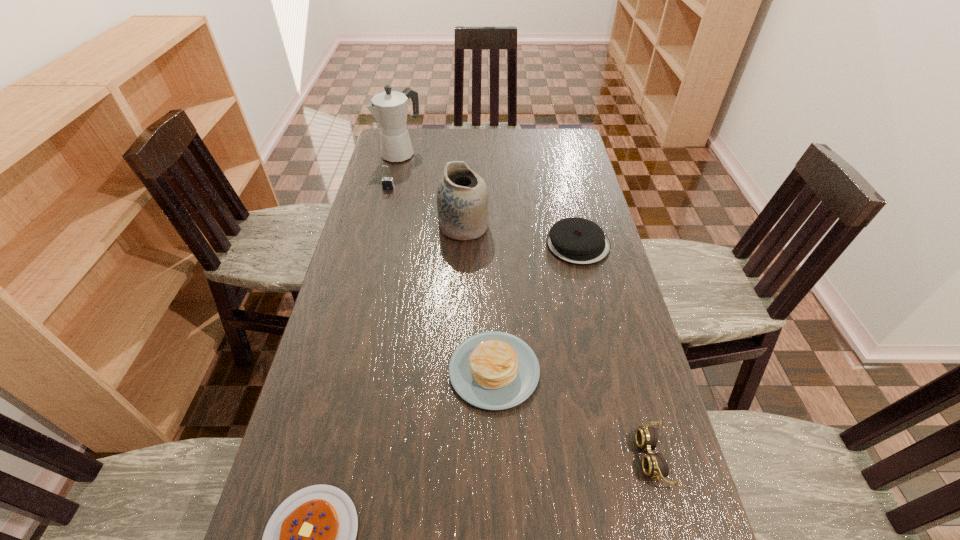
Locate an element on the screen. The height and width of the screenshot is (540, 960). free space located on the left of the pottery is located at coordinates (378, 226).

Identify the location of vacant region located on the shackle of the padlock. This screenshot has width=960, height=540. (384, 205).

Where is `vacant space located on the back of the rightmost pancake`? vacant space located on the back of the rightmost pancake is located at coordinates (562, 174).

Image resolution: width=960 pixels, height=540 pixels. In order to click on free spot located 0.240m on the right of the second pancake from right to left in this screenshot , I will do `click(636, 370)`.

Where is `vacant space located 0.350m through the lenses of the goggles`? This screenshot has width=960, height=540. vacant space located 0.350m through the lenses of the goggles is located at coordinates (474, 457).

This screenshot has width=960, height=540. I want to click on vacant space located 0.110m through the lenses of the goggles, so click(x=587, y=457).

Where is `vacant region located 0.050m through the lenses of the goggles`? Image resolution: width=960 pixels, height=540 pixels. vacant region located 0.050m through the lenses of the goggles is located at coordinates (614, 457).

You are a GUI agent. You are given a task and a screenshot of the screen. Output one action in this format:
    pyautogui.click(x=<x>, y=<y>)
    Task: Click on the object located at the far edge
    
    Given the screenshot: What is the action you would take?
    pyautogui.click(x=389, y=108)

The image size is (960, 540). What are the coordinates of `coffeepot at the left edge` in the screenshot? It's located at (389, 108).

What are the coordinates of `padlock that is at the left edge` in the screenshot? It's located at (387, 182).